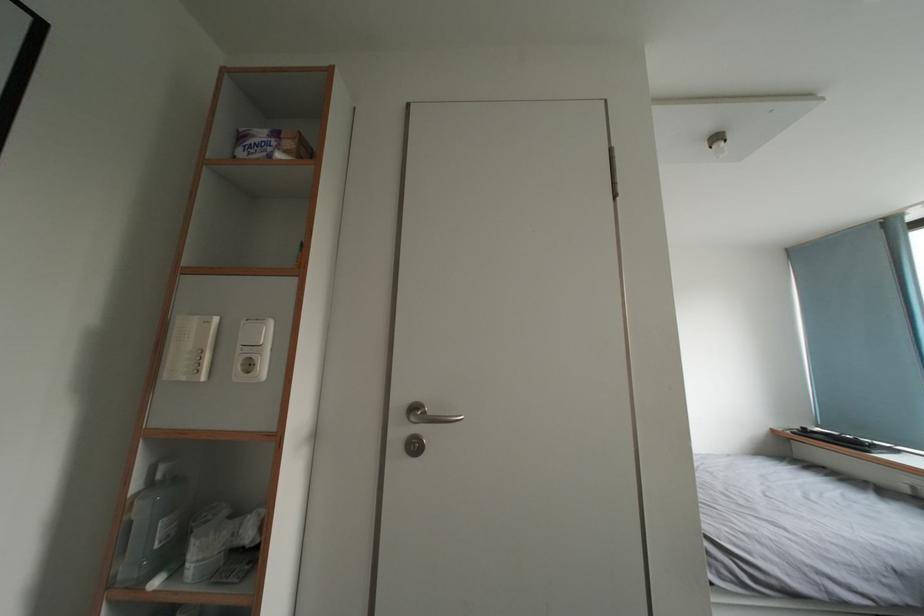
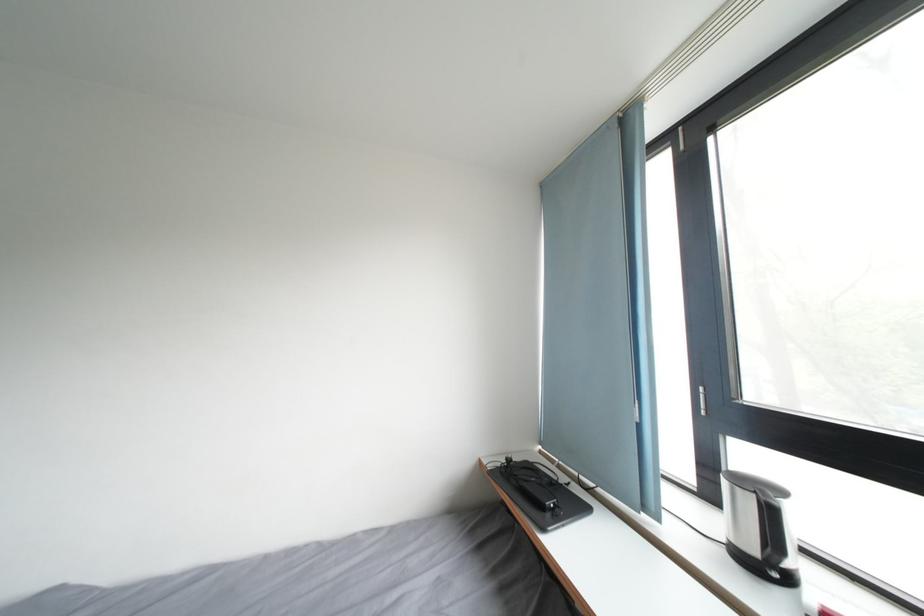
The images are taken continuously from a first-person perspective. In which direction are you moving?

The cameraman moved toward right, forward.